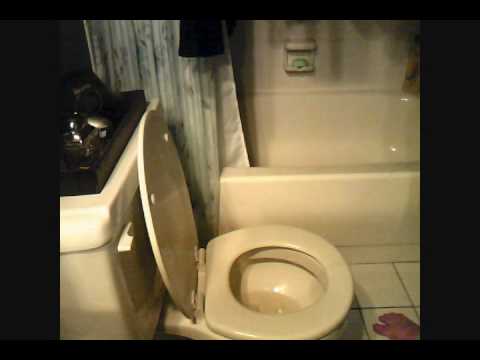
Identify the location of toilet flush handle. The image size is (480, 360). (125, 237).